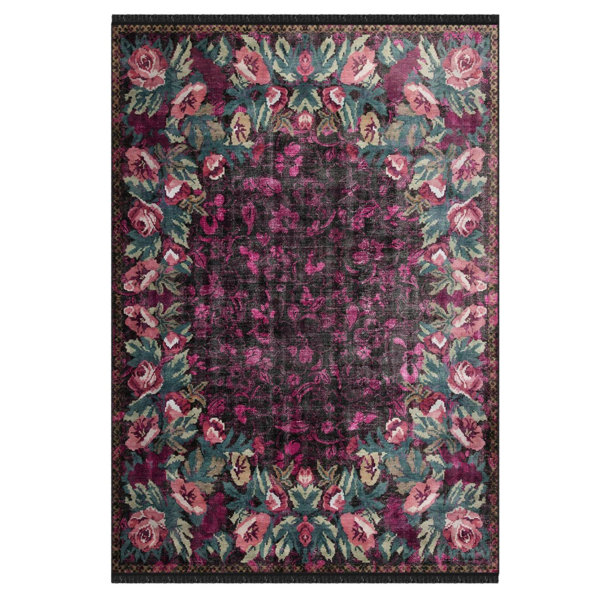
The height and width of the screenshot is (600, 600). I want to click on bottom edge of the rug, so click(358, 578).